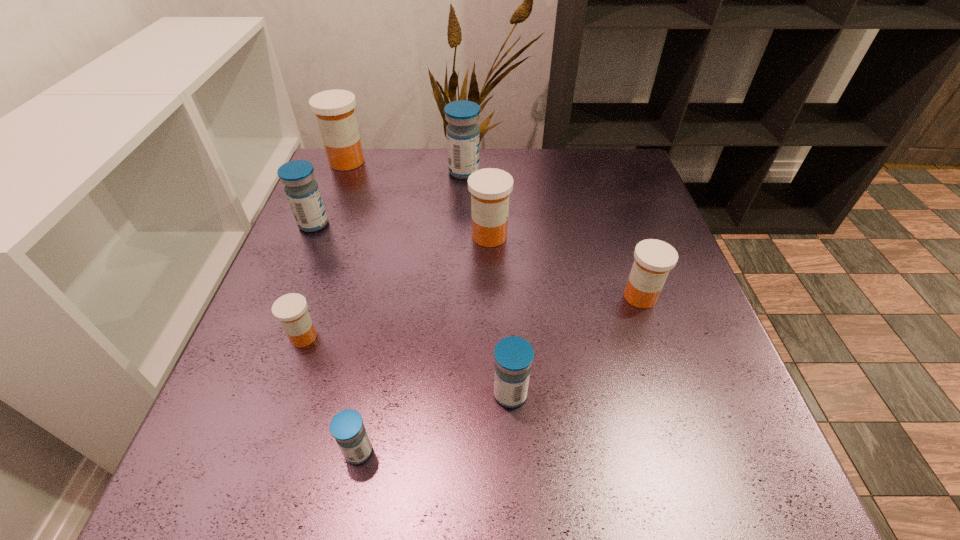
I want to click on the third biggest blue medicine, so click(x=513, y=355).

The height and width of the screenshot is (540, 960). What are the coordinates of `the third nearest object` in the screenshot? It's located at (291, 310).

Image resolution: width=960 pixels, height=540 pixels. I want to click on the nearest orange medicine, so click(x=291, y=310).

Image resolution: width=960 pixels, height=540 pixels. Find the location of `the nearest blue medicine`. the nearest blue medicine is located at coordinates (347, 427).

What are the coordinates of `the nearest object` in the screenshot? It's located at (347, 427).

Image resolution: width=960 pixels, height=540 pixels. I want to click on free space located on the label of the biggest orange medicine, so click(499, 161).

Where is `vacant space located 0.080m on the back of the second blue medicine from right to left`? This screenshot has height=540, width=960. vacant space located 0.080m on the back of the second blue medicine from right to left is located at coordinates (465, 148).

The image size is (960, 540). I want to click on free region located on the label of the second biggest orange medicine, so click(x=322, y=236).

Find the location of a particular element. The height and width of the screenshot is (540, 960). vacant space located 0.340m on the label of the second biggest orange medicine is located at coordinates point(322,236).

Locate an element on the screen. This screenshot has width=960, height=540. blank space located 0.190m on the label of the second biggest orange medicine is located at coordinates (387, 236).